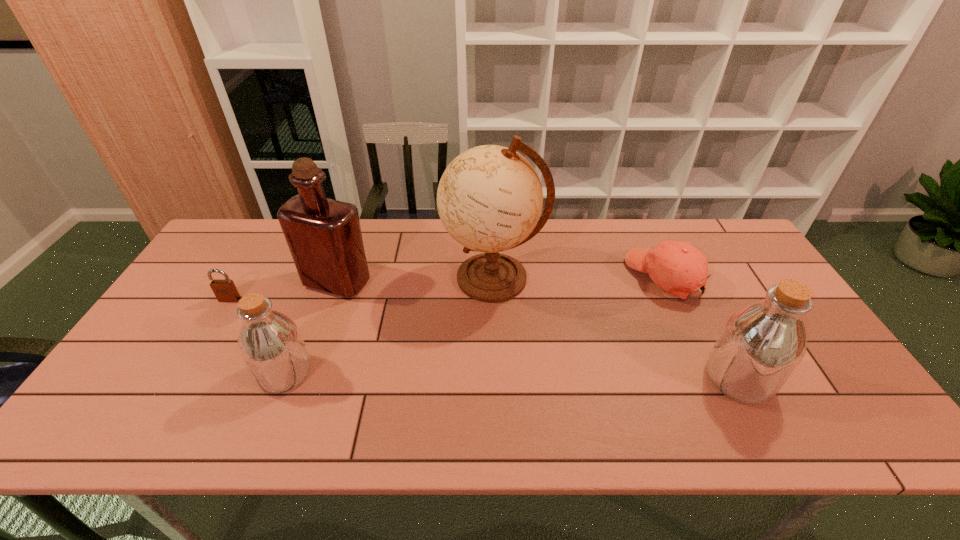
To make them evenly spaced by inserting another bottle among them, please locate a free space for this new bottle. Please provide its 2D coordinates. Your answer should be formatted as a tuple, i.e. [(x, y)], where the tuple contains the x and y coordinates of a point satisfying the conditions above.

[(511, 376)]